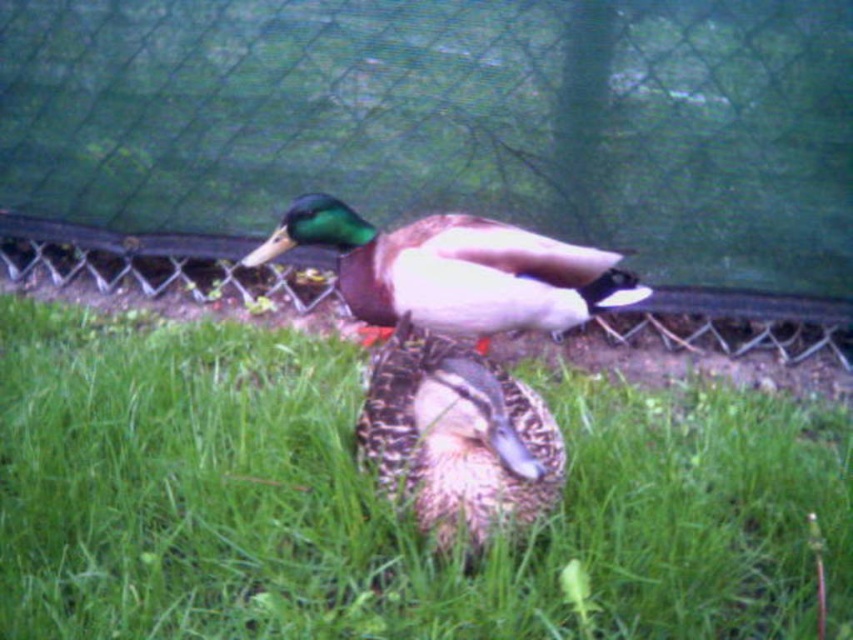
You are a photographer standing in the grassy area and want to take a photo of both points mentioned. If you move closer to the point at point (625,29), will the other point at point (331,573) become less visible in your frame?

Since point (625,29) is closer to you than point (331,573), moving closer to it may cause the other point to become less visible depending on your camera angle and zoom level.

You are a birdwatcher trying to capture both the green mesh fence at center and the speckled feather duck at center in a single photo. Based on their sizes, which object should you focus on to ensure both fit in the frame?

The green mesh fence at center is wider than the speckled feather duck at center, so you should focus on the green mesh fence at center to ensure both fit in the frame.

From the picture: You are a birdwatcher observing the scene. You notice the green grass at center and the speckled feather duck at center. Which object is taller in this scene?

The green grass at center is much taller than the speckled feather duck at center.